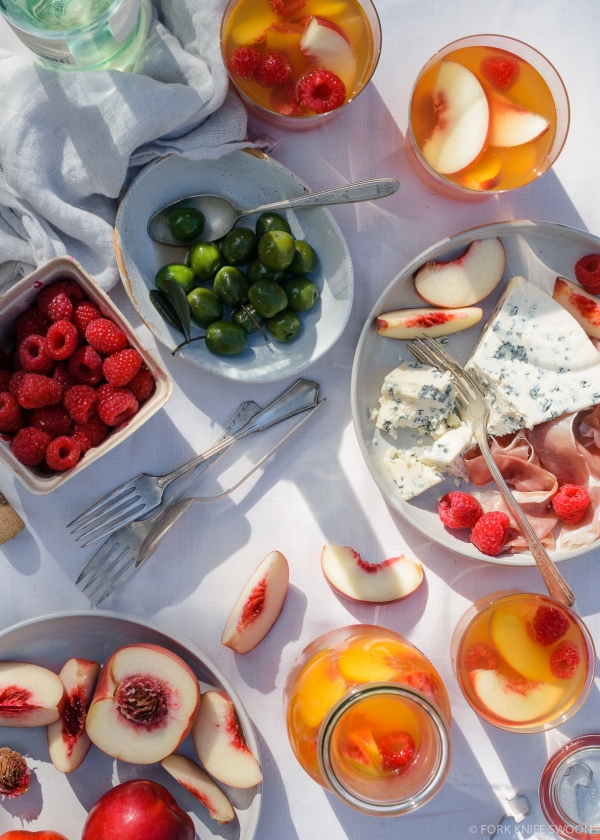
Locate an element on the screen. This screenshot has height=840, width=600. jar lid is located at coordinates (561, 773).